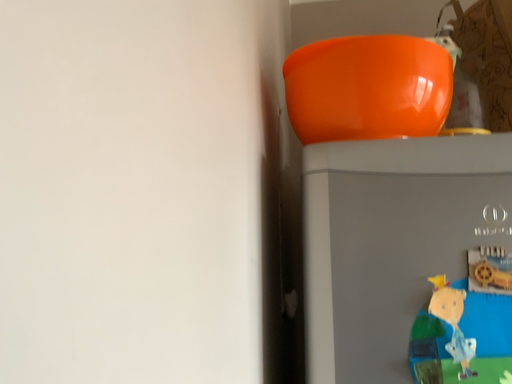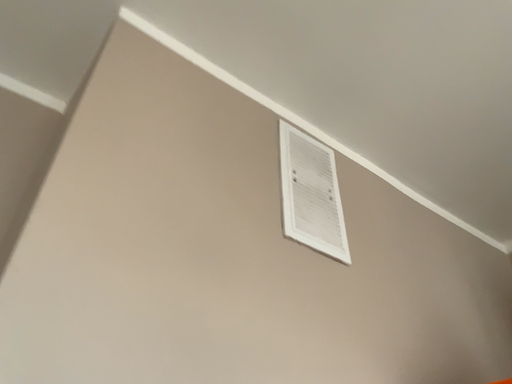
Question: How did the camera likely rotate when shooting the video?

Choices:
 (A) rotated left
 (B) rotated right

Answer: (A)